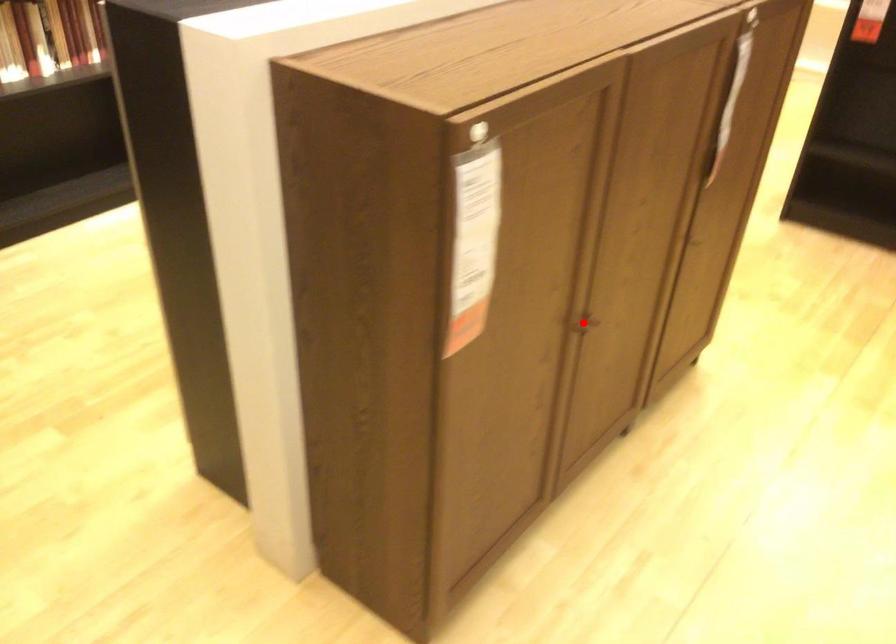
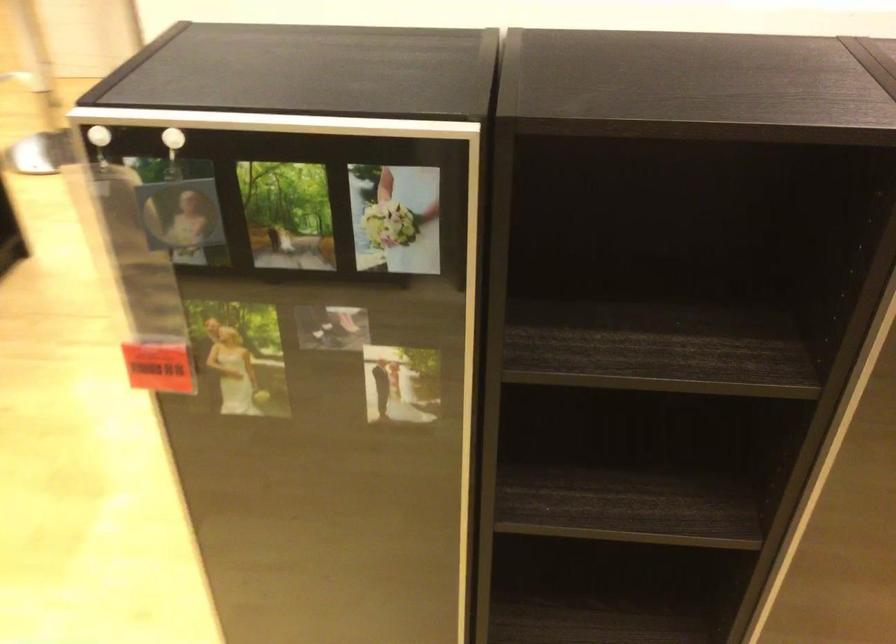
Question: I am providing you with two images of the same scene from different viewpoints. A red point is marked on the first image. At the location where the point appears in image 1, is it still visible in image 2?

Choices:
 (A) Yes
 (B) No

Answer: (B)